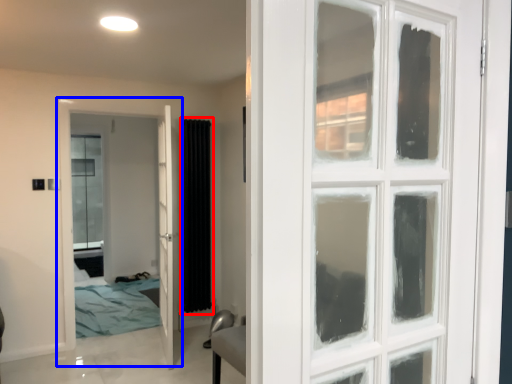
Question: Which point is further to the camera, curtain (highlighted by a red box) or door (highlighted by a blue box)?

Choices:
 (A) curtain
 (B) door

Answer: (A)